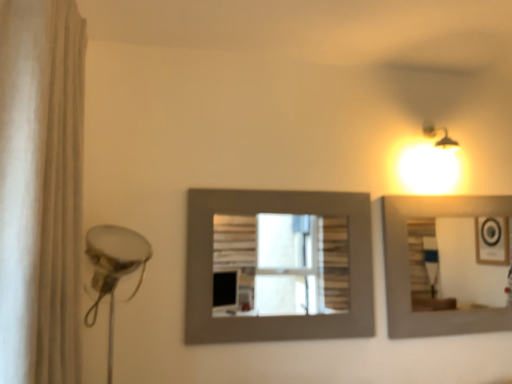
Question: Is point click(61, 134) closer or farther from the camera than point click(258, 198)?

Choices:
 (A) closer
 (B) farther

Answer: (A)

Question: From the image's perspective, is white fabric shower curtain at left above or below matte gray picture frame at center?

Choices:
 (A) above
 (B) below

Answer: (A)

Question: Choose the correct answer: Is white fabric shower curtain at left inside matte gray picture frame at center or outside it?

Choices:
 (A) outside
 (B) inside

Answer: (A)

Question: Considering the positions of matte gray picture frame at center and white fabric shower curtain at left in the image, is matte gray picture frame at center taller or shorter than white fabric shower curtain at left?

Choices:
 (A) tall
 (B) short

Answer: (B)

Question: Looking at their shapes, would you say matte gray picture frame at center is wider or thinner than white fabric shower curtain at left?

Choices:
 (A) thin
 (B) wide

Answer: (A)

Question: Considering the positions of matte gray picture frame at center and white fabric shower curtain at left in the image, is matte gray picture frame at center bigger or smaller than white fabric shower curtain at left?

Choices:
 (A) small
 (B) big

Answer: (A)

Question: From the image's perspective, is matte gray picture frame at center located above or below white fabric shower curtain at left?

Choices:
 (A) below
 (B) above

Answer: (A)